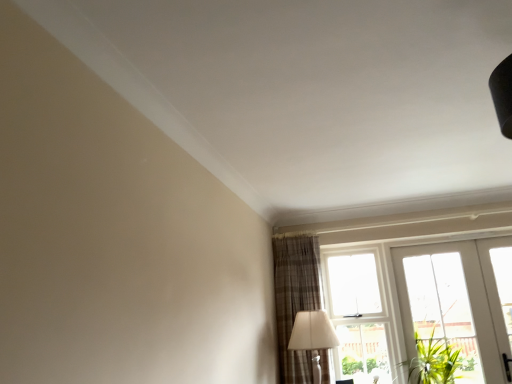
Question: Considering the relative sizes of white fabric lampshade at lower right and white glossy door at lower right in the image provided, is white fabric lampshade at lower right smaller than white glossy door at lower right?

Choices:
 (A) yes
 (B) no

Answer: (B)

Question: Is white fabric lampshade at lower right next to white glossy door at lower right?

Choices:
 (A) yes
 (B) no

Answer: (B)

Question: Is white fabric lampshade at lower right not close to white glossy door at lower right?

Choices:
 (A) yes
 (B) no

Answer: (A)

Question: Considering the relative positions of white fabric lampshade at lower right and white glossy door at lower right in the image provided, is white fabric lampshade at lower right behind white glossy door at lower right?

Choices:
 (A) yes
 (B) no

Answer: (B)

Question: Could you tell me if white fabric lampshade at lower right is facing white glossy door at lower right?

Choices:
 (A) no
 (B) yes

Answer: (A)

Question: From a real-world perspective, is plaid fabric curtain at lower right positioned above or below white fabric lampshade at lower right?

Choices:
 (A) above
 (B) below

Answer: (A)

Question: Is plaid fabric curtain at lower right inside or outside of white fabric lampshade at lower right?

Choices:
 (A) outside
 (B) inside

Answer: (A)

Question: Considering the positions of plaid fabric curtain at lower right and white fabric lampshade at lower right in the image, is plaid fabric curtain at lower right bigger or smaller than white fabric lampshade at lower right?

Choices:
 (A) small
 (B) big

Answer: (B)

Question: From the image's perspective, is plaid fabric curtain at lower right above or below white fabric lampshade at lower right?

Choices:
 (A) below
 (B) above

Answer: (B)

Question: Is point (307, 329) positioned closer to the camera than point (300, 261)?

Choices:
 (A) farther
 (B) closer

Answer: (B)

Question: Looking at the image, does white fabric lampshade at lower right seem bigger or smaller compared to plaid fabric curtain at lower right?

Choices:
 (A) big
 (B) small

Answer: (B)

Question: From the image's perspective, is white fabric lampshade at lower right above or below plaid fabric curtain at lower right?

Choices:
 (A) above
 (B) below

Answer: (B)

Question: Is white fabric lampshade at lower right situated inside plaid fabric curtain at lower right or outside?

Choices:
 (A) inside
 (B) outside

Answer: (A)

Question: Choose the correct answer: Is transparent glass window at upper right inside white fabric lampshade at lower right or outside it?

Choices:
 (A) outside
 (B) inside

Answer: (A)

Question: In terms of width, does transparent glass window at upper right look wider or thinner when compared to white fabric lampshade at lower right?

Choices:
 (A) wide
 (B) thin

Answer: (B)